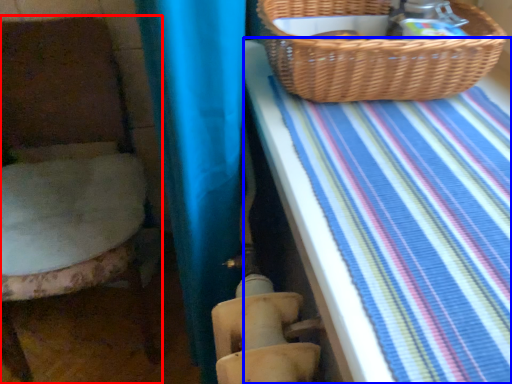
Question: Which object appears closest to the camera in this image, furniture (highlighted by a red box) or sheet (highlighted by a blue box)?

Choices:
 (A) furniture
 (B) sheet

Answer: (B)